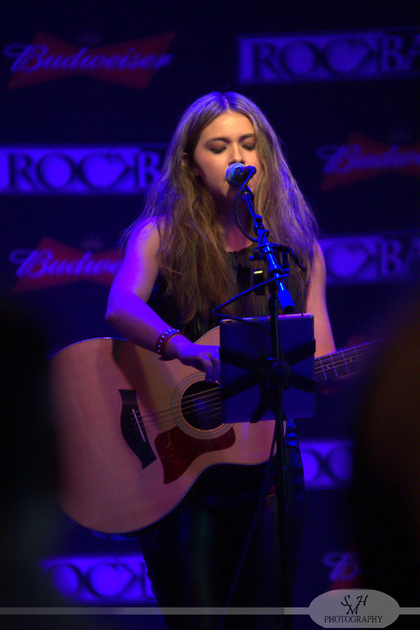
Find the location of a particular element. mic is located at coordinates (271, 265).